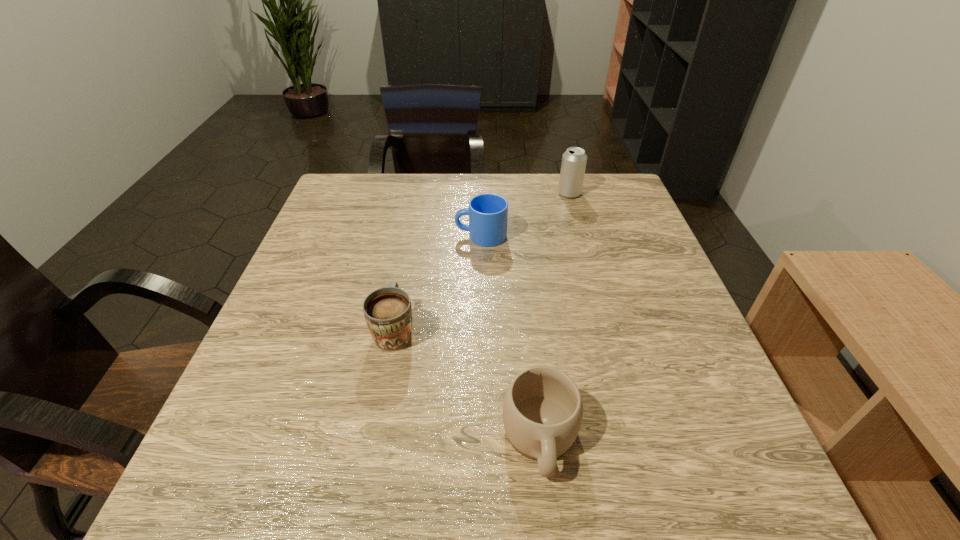
Image resolution: width=960 pixels, height=540 pixels. Identify the location of vacant area situated 0.380m on the side of the leftmost object with the handle. (418, 207).

Locate an element on the screen. This screenshot has height=540, width=960. free space located 0.130m on the side of the leftmost object with the handle is located at coordinates (406, 266).

Locate an element on the screen. blank space located on the side of the leftmost object with the handle is located at coordinates (414, 231).

This screenshot has width=960, height=540. In order to click on object that is at the far edge in this screenshot , I will do `click(574, 160)`.

Where is `object that is at the near edge`? The image size is (960, 540). object that is at the near edge is located at coordinates (542, 411).

The image size is (960, 540). What are the coordinates of `object that is at the right edge` in the screenshot? It's located at click(574, 160).

Locate an element on the screen. This screenshot has height=540, width=960. object positioned at the far right corner is located at coordinates (574, 160).

Find the location of a particular element. The height and width of the screenshot is (540, 960). free space at the left edge of the desktop is located at coordinates (287, 363).

At what (x,y) coordinates should I click in order to perform the action: click on vacant space at the right edge. Please return your answer as a coordinate pair (x, y). The image size is (960, 540). Looking at the image, I should click on (608, 278).

Locate an element on the screen. This screenshot has height=540, width=960. vacant space at the far left corner of the desktop is located at coordinates (355, 189).